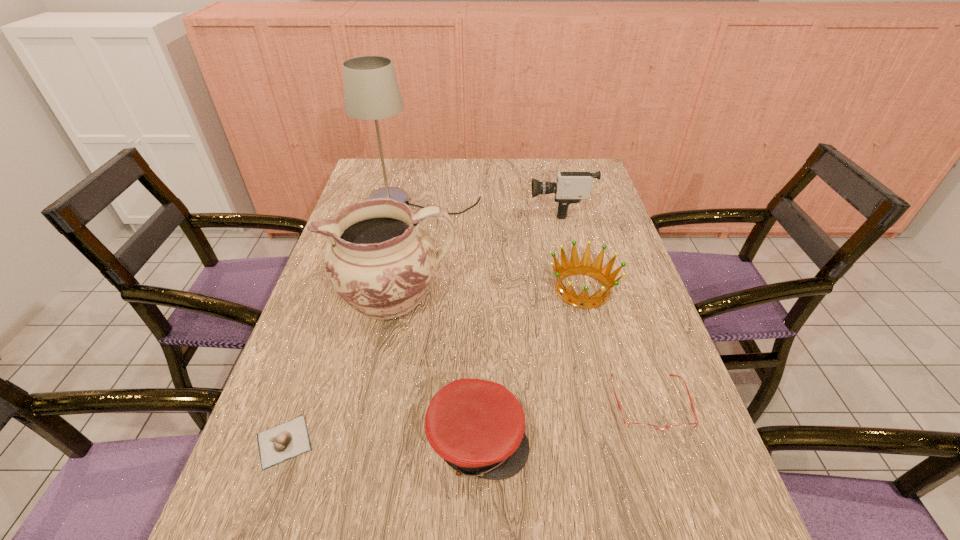
The width and height of the screenshot is (960, 540). Find the location of `free point that satisfies the following two spatial constraints: 1. on the recording direction of the crown; 2. on the left side of the third tallest object`. free point that satisfies the following two spatial constraints: 1. on the recording direction of the crown; 2. on the left side of the third tallest object is located at coordinates (579, 289).